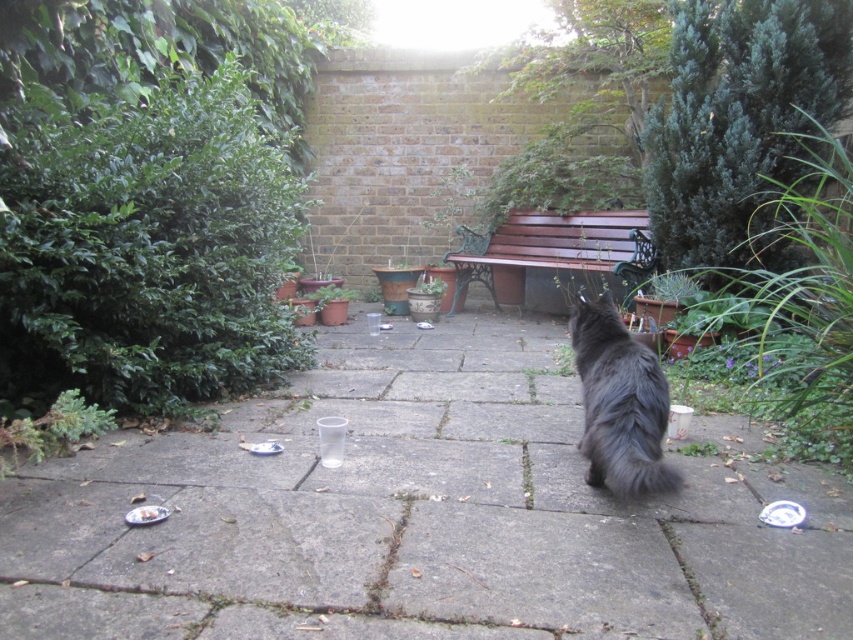
You are a photographer setting up equipment on the wooden bench at center. You want to take a photo of the black fluffy cat at center without moving the bench. Is the cat within a 2 meter range from the bench?

The black fluffy cat at center and wooden bench at center are 2.28 meters apart, so the cat is slightly beyond the 2 meter range from the bench.

You are a photographer setting up equipment on the wooden bench at center. You want to take a photo of the black fluffy cat at center without it being blocked by the bench. Is the cat tall enough to be seen over the bench?

The black fluffy cat at center has a lesser height compared to wooden bench at center, so the cat would be partially or fully blocked by the bench when viewed from above. Adjust the camera angle or move the bench to ensure the cat is visible.